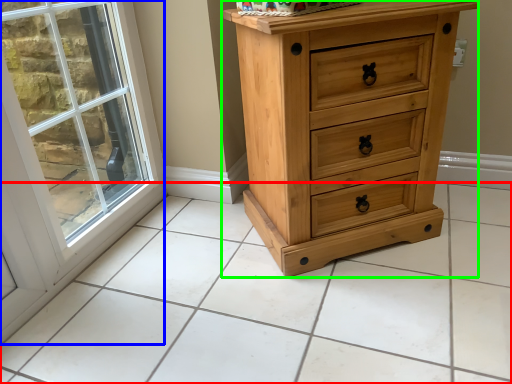
Question: Considering the real-world distances, which object is farthest from tile (highlighted by a red box)? window (highlighted by a blue box) or chest of drawers (highlighted by a green box)?

Choices:
 (A) window
 (B) chest of drawers

Answer: (A)